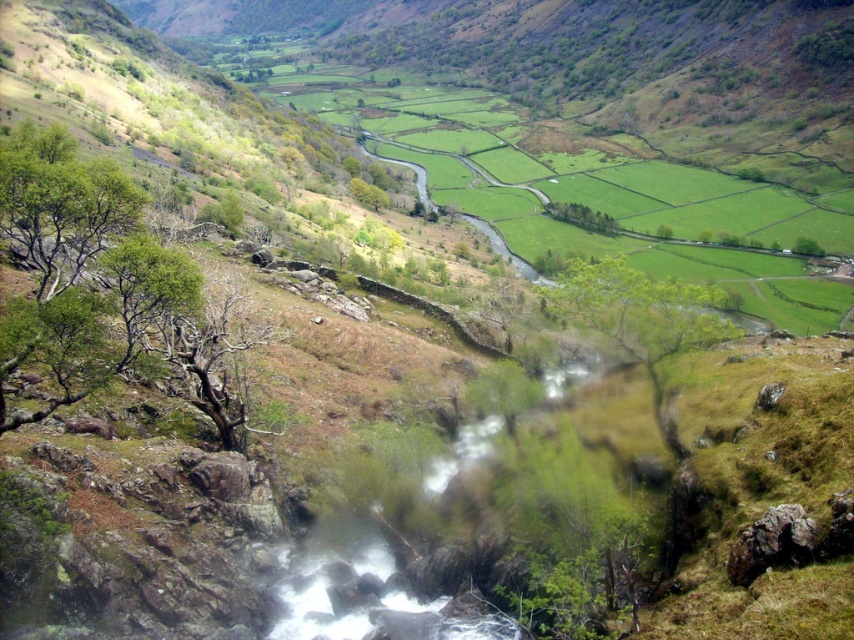
You are standing at the point marked as point (106,282) and want to walk to the point marked as point (647,358). Which direction should you move relative to your current position?

You should move forward because point (647,358) is further away from the camera than point (106,282), so moving forward from your current position will take you towards it.